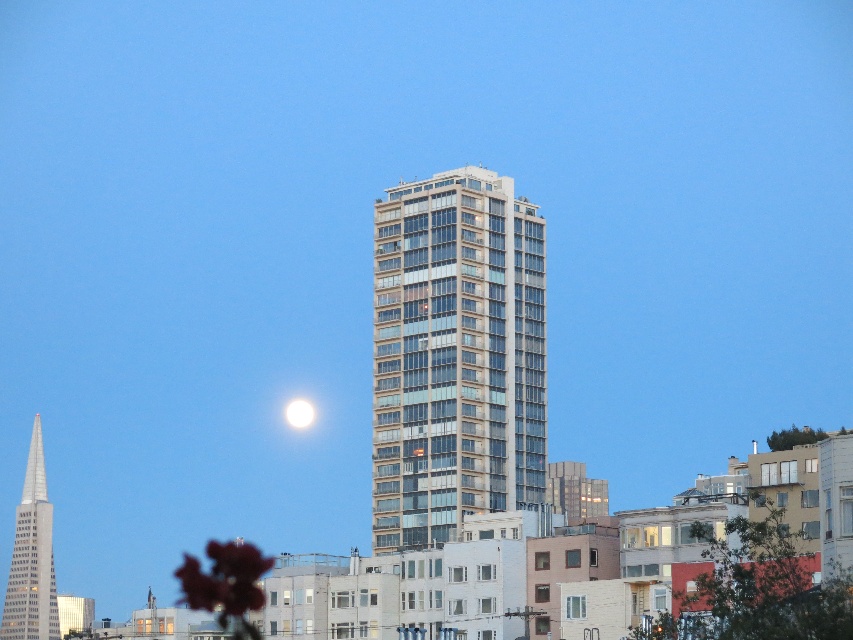
You are standing in the city at night and see a bright light coming from the point at coordinates point [32,556]. What object is located at that point?

The point [32,556] corresponds to the polished glass skyscraper at left.

You are standing at the center of the city square and want to take a photo of the glassy concrete building at center. According to the scene description, where should you position yourself to capture the building in the center of your camera frame?

You should position yourself directly in front of the glassy concrete building at center, as its coordinates are at point (456,355), which places it centrally in the frame.

Based on the scene description, where is the glassy concrete building at center located in terms of its 2D coordinates?

The glassy concrete building at center is located at the 2D coordinates of point (456, 355).